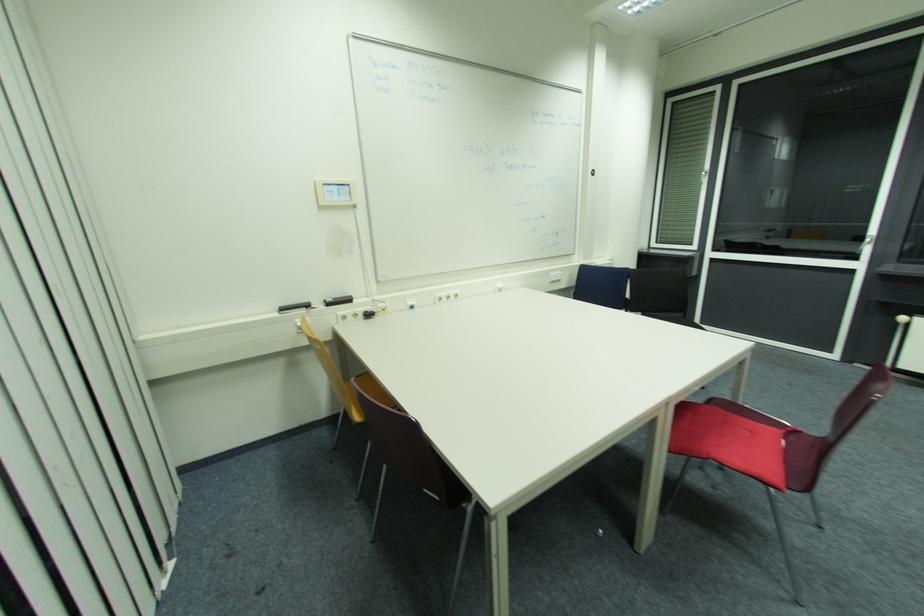
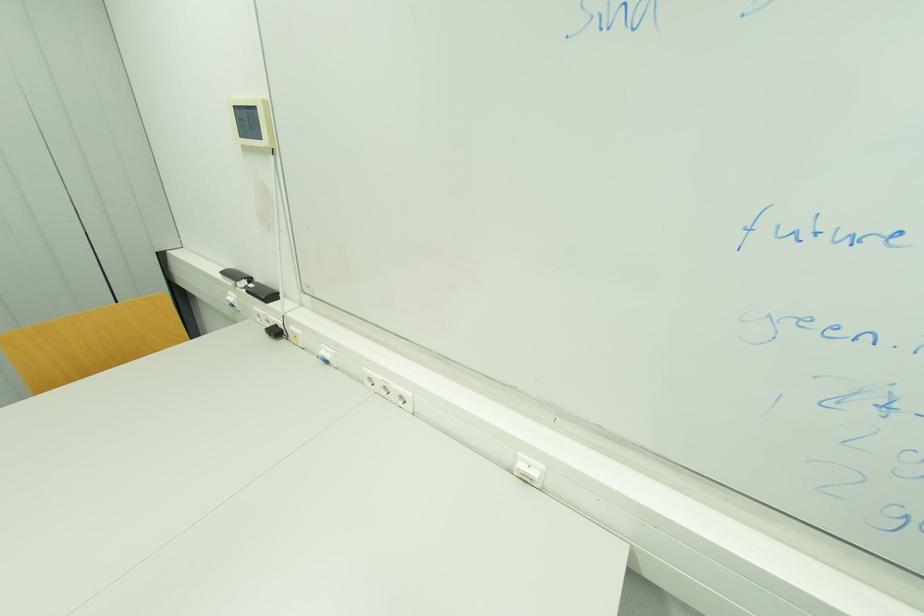
Find the pixel in the second image that matches pixel 371 315 in the first image.

(281, 333)